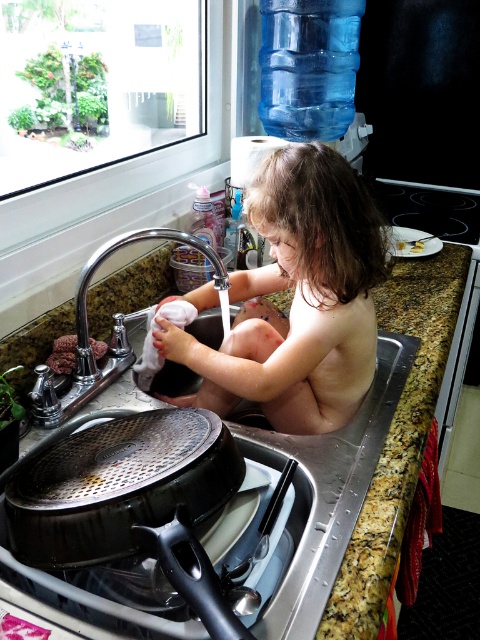
Between granite at upper right and silver metallic faucet at upper left, which one is positioned higher?

silver metallic faucet at upper left is above.

Between point (386, 529) and point (228, 300), which one is positioned in front?

Positioned in front is point (386, 529).

Is point (436, 365) positioned behind point (223, 320)?

Yes, point (436, 365) is farther from viewer.

The image size is (480, 640). I want to click on granite at upper right, so click(397, 436).

In the scene shown: Can you confirm if granite countertop at sink is taller than silver metallic faucet at upper left?

Yes, granite countertop at sink is taller than silver metallic faucet at upper left.

Is granite countertop at sink to the left of silver metallic faucet at upper left from the viewer's perspective?

In fact, granite countertop at sink is to the right of silver metallic faucet at upper left.

Between point (446, 310) and point (153, 227), which one is positioned behind?

The point (446, 310) is more distant.

Locate an element on the screen. This screenshot has height=640, width=480. granite countertop at sink is located at coordinates (397, 436).

Between point (328, 172) and point (93, 352), which one is positioned in front?

Point (328, 172)

Is naked toddler at sink to the right of brown crumbly food at sink left from the viewer's perspective?

Correct, you'll find naked toddler at sink to the right of brown crumbly food at sink left.

Between point (324, 212) and point (70, 368), which one is positioned in front?

Point (324, 212) is in front.

Identify the location of naked toddler at sink. This screenshot has width=480, height=640. (297, 300).